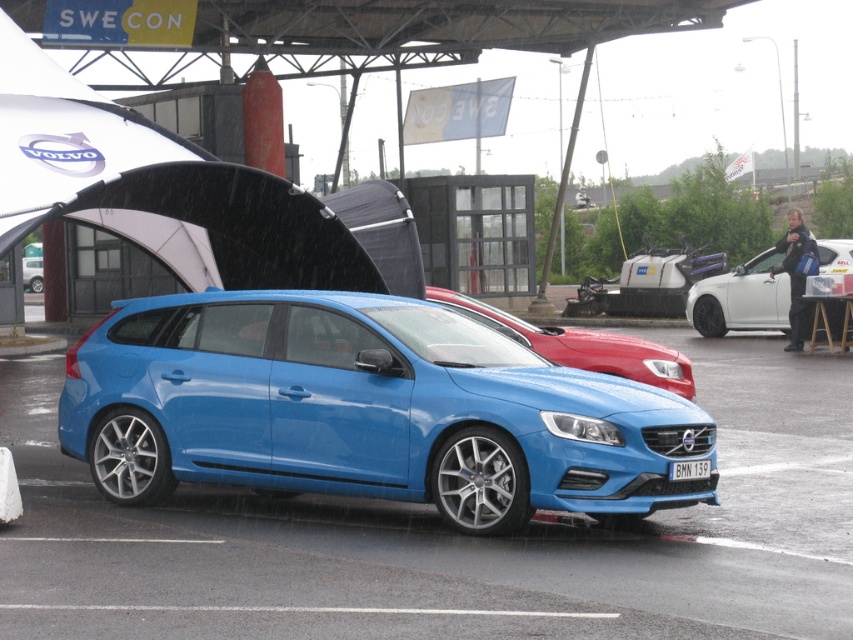
You are a photographer at the event and want to capture both the white glossy sedan at center and the white plastic license plate at center in a single shot. Based on their positions, which one should you focus on first to ensure both are in frame?

You should focus on the white glossy sedan at center first because it is positioned to the right of the white plastic license plate at center, so adjusting the camera to include the sedan on the right will naturally include the license plate on the left in the frame.

Consider the image. You are standing at the entrance of the car exhibition and see two points marked on the blue Volvo V60. The first point is at coordinates point (242, 308) and the second is at point (766, 264). Which of these two points is closer to you?

Point (242, 308) is closer to the viewer than point (766, 264).

You are standing at the entrance of the car exhibition and want to locate the white glossy sedan at center. According to the coordinates provided, where should you look to find it?

The white glossy sedan at center is located at coordinates point (741, 298).